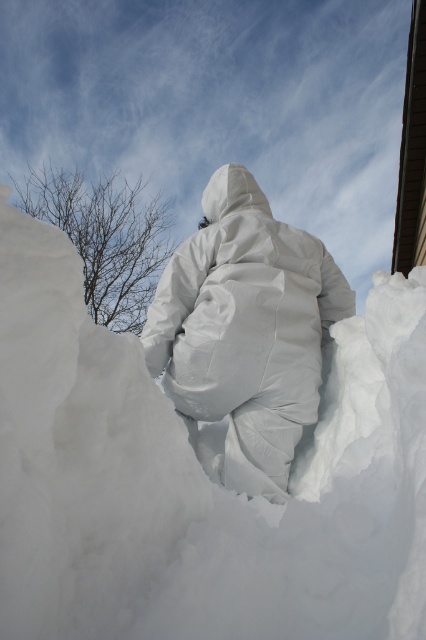
Who is more forward, (216, 493) or (221, 280)?

Positioned in front is point (216, 493).

Does white fluffy snow at center appear over white matte snowsuit at center?

Incorrect, white fluffy snow at center is not positioned above white matte snowsuit at center.

Measure the distance between white fluffy snow at center and camera.

A distance of 1.37 meters exists between white fluffy snow at center and camera.

At what (x,y) coordinates should I click in order to perform the action: click on white fluffy snow at center. Please return your answer as a coordinate pair (x, y). Looking at the image, I should click on (199, 477).